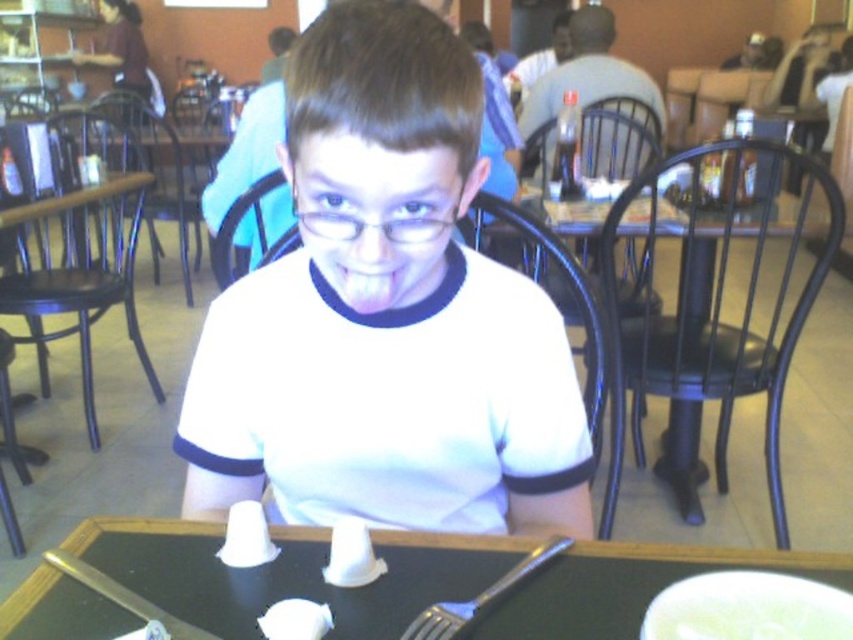
You are a waiter in the restaurant and need to pick up the shiny metal fork at lower center from the table. Can you reach it without moving the black plastic table at lower center?

The shiny metal fork at lower center is behind the black plastic table at lower center, so you cannot reach it without moving the table.

You are a waiter in the restaurant and you need to place both the shiny metallic fork at lower center and the shiny metal fork at lower center on the table. Which fork should you place first if you want to use the space efficiently?

The shiny metallic fork at lower center should be placed first because it occupies less space than the shiny metal fork at lower center, allowing more room for the larger fork afterward.

From the picture: You are a waiter in a restaurant and you see two forks on the table. One is labeled as the shiny metallic fork at lower center and the other is the shiny metal fork at lower center. Which fork is positioned higher on the table?

The shiny metallic fork at lower center is positioned higher than the shiny metal fork at lower center.